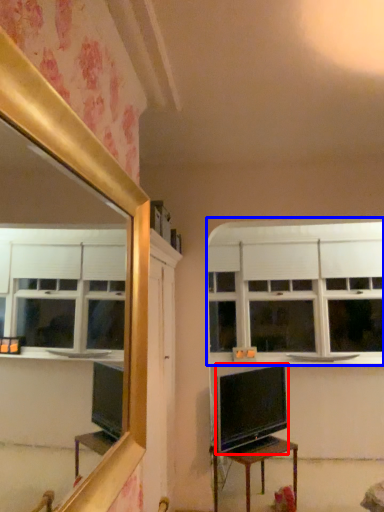
Question: Among these objects, which one is farthest to the camera, television (highlighted by a red box) or window (highlighted by a blue box)?

Choices:
 (A) television
 (B) window

Answer: (B)